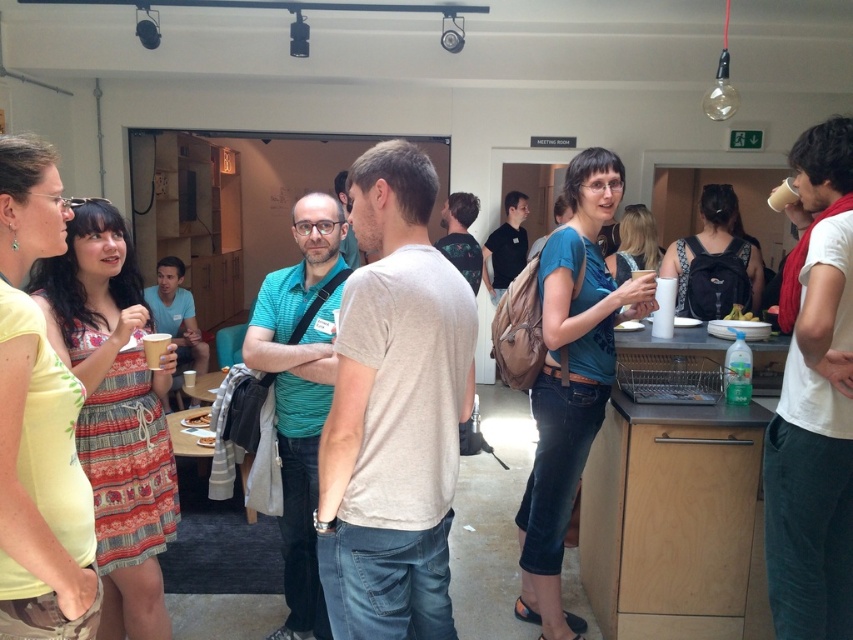
Does matte blue shirt at center appear under green matte broccoli at right?

Yes.

Locate an element on the screen. matte blue shirt at center is located at coordinates (572, 380).